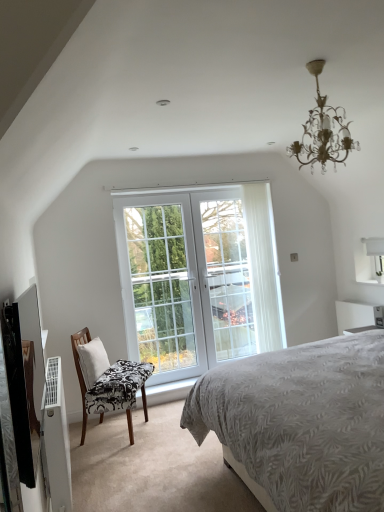
Question: From a real-world perspective, relative to white glass door at center, marked as the second window in a right-to-left arrangement, is white fabric pillow at left vertically above or below?

Choices:
 (A) above
 (B) below

Answer: (B)

Question: Is point (97, 376) positioned closer to the camera than point (203, 346)?

Choices:
 (A) farther
 (B) closer

Answer: (B)

Question: Based on their relative distances, which object is nearer to the white glass door at center, marked as the second window in a right-to-left arrangement?

Choices:
 (A) white sheer curtain at center
 (B) gold metallic chandelier at upper center
 (C) white fabric pillow at left
 (D) white plastic air conditioner at lower left
 (E) black and white patterned fabric chair at lower left

Answer: (E)

Question: Based on their relative distances, which object is nearer to the black and white patterned fabric chair at lower left?

Choices:
 (A) white plastic air conditioner at lower left
 (B) white glass door at center, placed as the first window when sorted from left to right
 (C) white sheer curtain at center
 (D) white glossy vanity at upper right
 (E) white fabric pillow at left

Answer: (E)